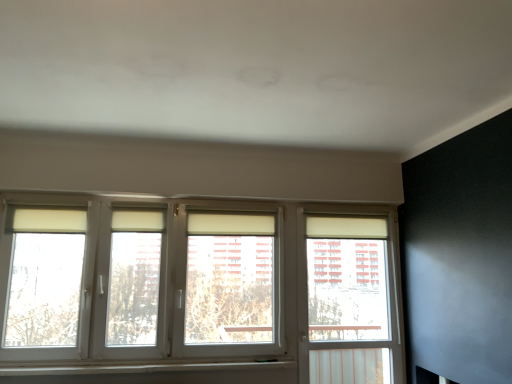
What do you see at coordinates (141, 368) in the screenshot? This screenshot has width=512, height=384. I see `white plastic window sill at lower center` at bounding box center [141, 368].

Measure the distance between white plastic window at center and camera.

The distance of white plastic window at center from camera is 2.70 meters.

Locate an element on the screen. This screenshot has width=512, height=384. white plastic window at center is located at coordinates (198, 290).

At what (x,y) coordinates should I click in order to perform the action: click on white plastic window sill at lower center. Please return your answer as a coordinate pair (x, y). Looking at the image, I should click on (141, 368).

From the image's perspective, does white plastic window at center appear lower than white plastic window sill at lower center?

Actually, white plastic window at center appears above white plastic window sill at lower center in the image.

In the scene shown: Which is more to the left, white plastic window at center or white plastic window sill at lower center?

white plastic window at center.

Which point is more distant from viewer, (262, 322) or (190, 370)?

The point (262, 322) is farther.

Which of these two, white plastic window at center or white plastic window sill at lower center, is wider?

With larger width is white plastic window at center.

Who is smaller, white plastic window at center or white plastic window at right?

With smaller size is white plastic window at right.

From the image's perspective, is white plastic window at center above or below white plastic window at right?

From the image's perspective, white plastic window at center appears above white plastic window at right.

Does white plastic window at center contain white plastic window at right?

No, white plastic window at right is not a part of white plastic window at center.

Between white plastic window at right and white plastic window at center, which one is positioned behind?

white plastic window at right is more distant.

Is white plastic window at right bigger or smaller than white plastic window at center?

In the image, white plastic window at right appears to be smaller than white plastic window at center.

Looking at this image, is white plastic window at right at the right side of white plastic window at center?

Indeed, white plastic window at right is positioned on the right side of white plastic window at center.

From a real-world perspective, who is located higher, white plastic window at right or white plastic window at center?

white plastic window at center.

Which of these two, white plastic window sill at lower center or white plastic window at center, is thinner?

Thinner between the two is white plastic window sill at lower center.

Relative to white plastic window at center, is white plastic window sill at lower center in front or behind?

white plastic window sill at lower center is behind white plastic window at center.

Considering the relative sizes of white plastic window sill at lower center and white plastic window at center in the image provided, is white plastic window sill at lower center bigger than white plastic window at center?

No, white plastic window sill at lower center is not bigger than white plastic window at center.

Could you tell me if white plastic window sill at lower center is turned towards white plastic window at center?

Yes, white plastic window sill at lower center is turned towards white plastic window at center.

How distant is white plastic window sill at lower center from white plastic window at right?

white plastic window sill at lower center is 35.89 inches from white plastic window at right.

Is white plastic window sill at lower center oriented towards white plastic window at right?

No, white plastic window sill at lower center is not oriented towards white plastic window at right.

From a real-world perspective, relative to white plastic window at right, is white plastic window sill at lower center vertically above or below?

white plastic window sill at lower center is below white plastic window at right.

Is the surface of white plastic window sill at lower center in direct contact with white plastic window at right?

No, white plastic window sill at lower center is not making contact with white plastic window at right.

Which of these two, white plastic window at right or white plastic window sill at lower center, is smaller?

With smaller size is white plastic window sill at lower center.

Which of these two, white plastic window at right or white plastic window sill at lower center, is thinner?

white plastic window at right is thinner.

Is white plastic window at right positioned with its back to white plastic window sill at lower center?

No, white plastic window at right is not facing away from white plastic window sill at lower center.

At what (x,y) coordinates should I click in order to perform the action: click on window sill behind the white plastic window at center. Please return your answer as a coordinate pair (x, y). This screenshot has height=384, width=512. Looking at the image, I should click on (141, 368).

Find the location of a particular element. This screenshot has width=512, height=384. window frame below the white plastic window at center (from a real-world perspective) is located at coordinates (351, 301).

Estimate the real-world distances between objects in this image. Which object is further from white plastic window at center, white plastic window sill at lower center or white plastic window at right?

The object further to white plastic window at center is white plastic window sill at lower center.

When comparing their distances from white plastic window at right, does white plastic window sill at lower center or white plastic window at center seem further?

Among the two, white plastic window sill at lower center is located further to white plastic window at right.

Looking at the image, which one is located further to white plastic window at right, white plastic window at center or white plastic window sill at lower center?

white plastic window sill at lower center lies further to white plastic window at right than the other object.

Estimate the real-world distances between objects in this image. Which object is closer to white plastic window sill at lower center, white plastic window at right or white plastic window at center?

Among the two, white plastic window at center is located nearer to white plastic window sill at lower center.

Based on their spatial positions, is white plastic window at center or white plastic window at right closer to white plastic window sill at lower center?

white plastic window at center lies closer to white plastic window sill at lower center than the other object.

From the image, which object appears to be nearer to white plastic window at center, white plastic window at right or white plastic window sill at lower center?

white plastic window at right lies closer to white plastic window at center than the other object.

The image size is (512, 384). In order to click on window sill between white plastic window at center and white plastic window at right in this screenshot , I will do `click(141, 368)`.